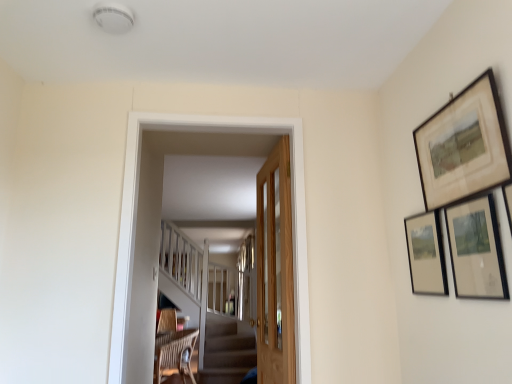
Question: Is wooden door at center wider or thinner than matte black picture frame at right, which is the second picture frame from bottom to top?

Choices:
 (A) wide
 (B) thin

Answer: (A)

Question: From a real-world perspective, is wooden door at center physically located above or below matte black picture frame at right, arranged as the 2th picture frame when viewed from the top?

Choices:
 (A) above
 (B) below

Answer: (A)

Question: Estimate the real-world distances between objects in this image. Which object is closer to the wooden-framed artwork at upper right, which is counted as the third picture frame, starting from the bottom?

Choices:
 (A) wooden door at center
 (B) matte black picture frame at right, which is the second picture frame from bottom to top
 (C) wooden-framed picture at upper right, which ranks as the first picture frame in bottom-to-top order
 (D) wooden door at center

Answer: (B)

Question: Estimate the real-world distances between objects in this image. Which object is closer to the matte black picture frame at right, which is the second picture frame from bottom to top?

Choices:
 (A) wooden-framed artwork at upper right, the first picture frame when ordered from top to bottom
 (B) wooden door at center
 (C) wooden-framed picture at upper right, which ranks as the first picture frame in bottom-to-top order
 (D) wooden door at center

Answer: (A)